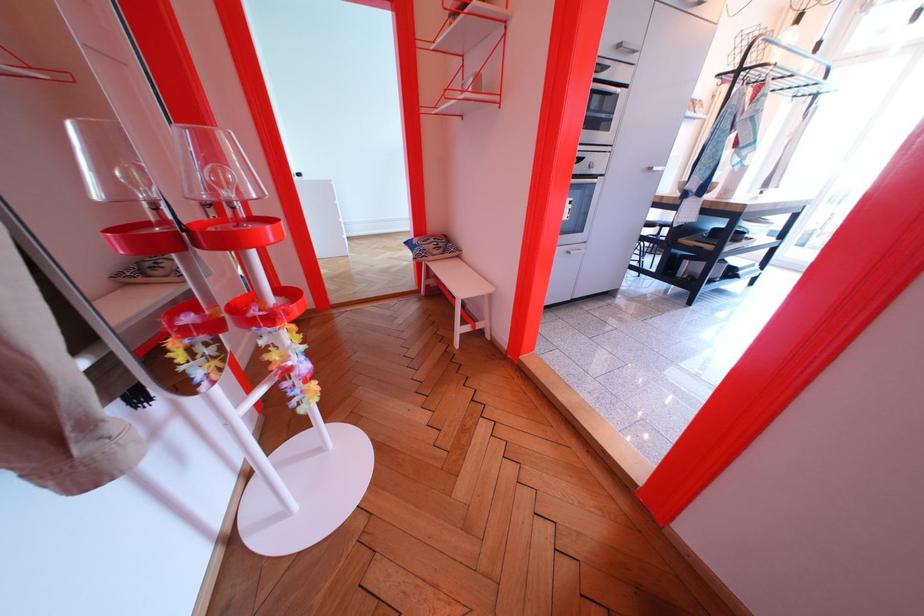
Find where to sit the bench sitting surface. Please return your answer as a coordinate pair (x, y).

(467, 281)